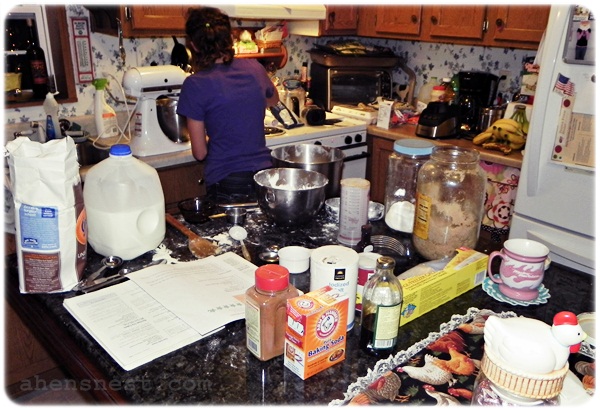
Identify the location of mixer. The width and height of the screenshot is (600, 410). (147, 79).